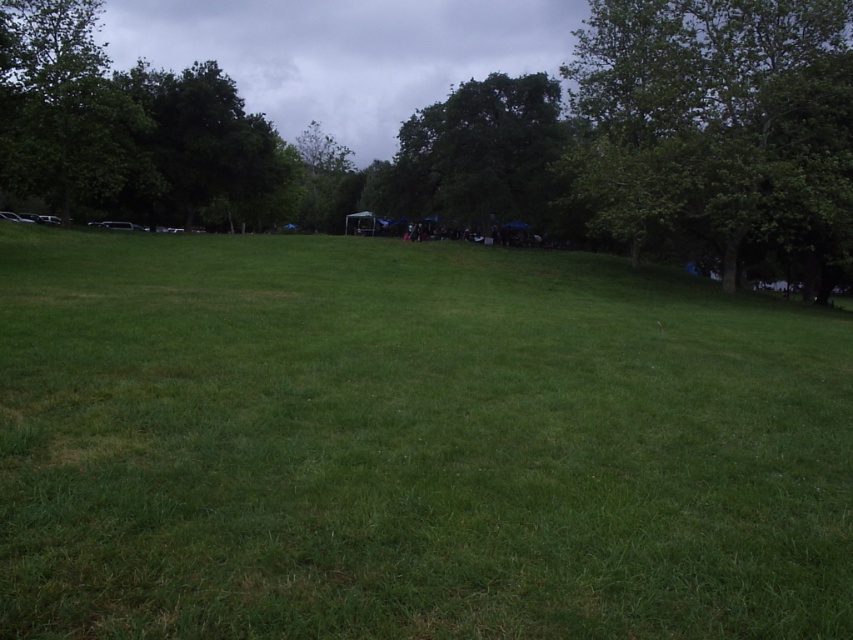
Does green leafy tree at upper right appear on the left side of green leafy tree at upper left?

No, green leafy tree at upper right is not to the left of green leafy tree at upper left.

The width and height of the screenshot is (853, 640). What are the coordinates of `green leafy tree at upper right` in the screenshot? It's located at (721, 124).

Is point (193, 461) closer to viewer compared to point (552, 88)?

Yes, point (193, 461) is in front of point (552, 88).

Can you confirm if green grass at center is bigger than green leafy tree at center?

Actually, green grass at center might be smaller than green leafy tree at center.

At what (x,y) coordinates should I click in order to perform the action: click on green grass at center. Please return your answer as a coordinate pair (x, y). The width and height of the screenshot is (853, 640). Looking at the image, I should click on (410, 444).

Can you confirm if green leafy tree at upper right is positioned to the right of green leafy tree at center?

Yes, green leafy tree at upper right is to the right of green leafy tree at center.

From the picture: Between green leafy tree at upper right and green leafy tree at center, which one has less height?

With less height is green leafy tree at upper right.

Locate an element on the screen. Image resolution: width=853 pixels, height=640 pixels. green leafy tree at upper right is located at coordinates (721, 124).

The height and width of the screenshot is (640, 853). Find the location of `green leafy tree at upper right`. green leafy tree at upper right is located at coordinates (721, 124).